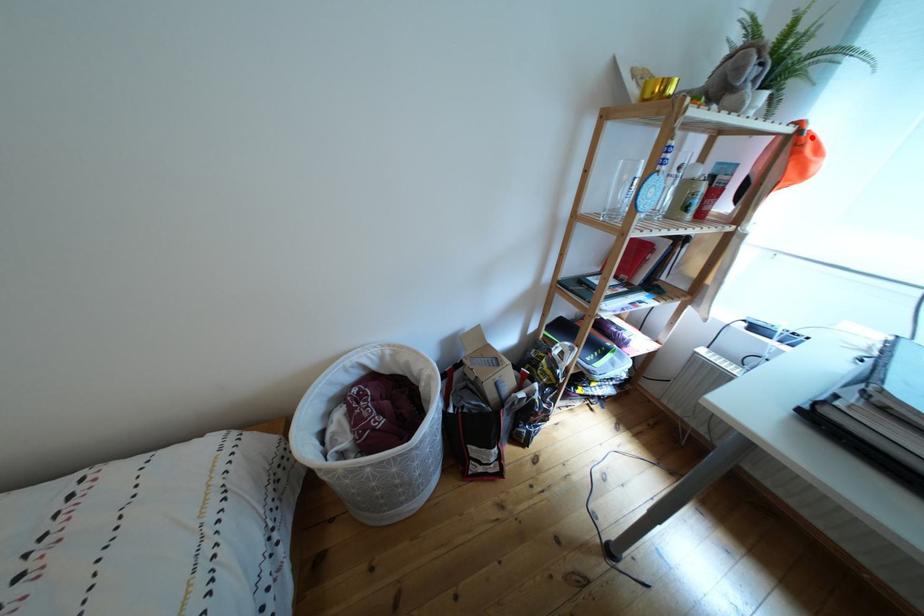
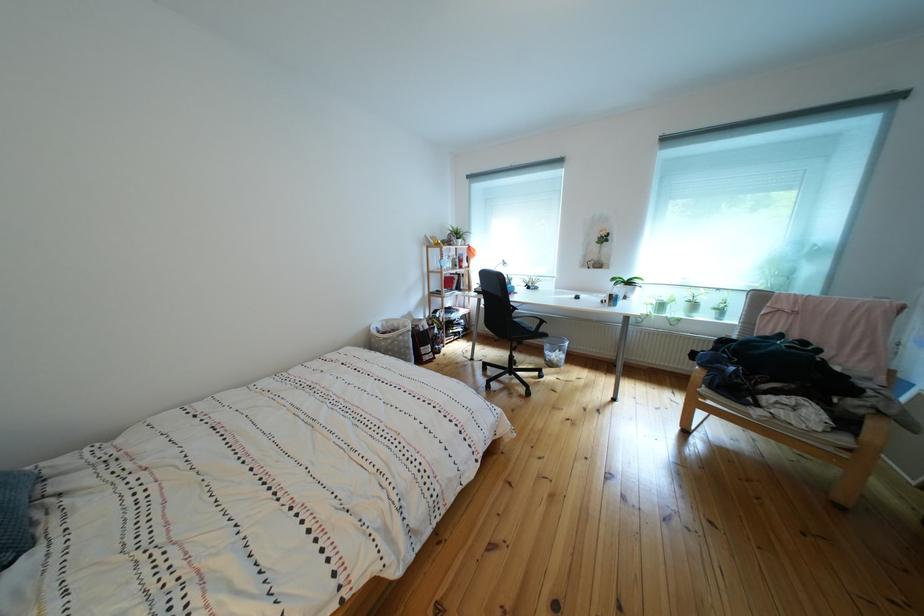
Question: I am providing you with two images of the same scene from different viewpoints. A red point is marked on the first image. At the location where the point appears in image 1, is it still visible in image 2?

Choices:
 (A) Yes
 (B) No

Answer: (B)